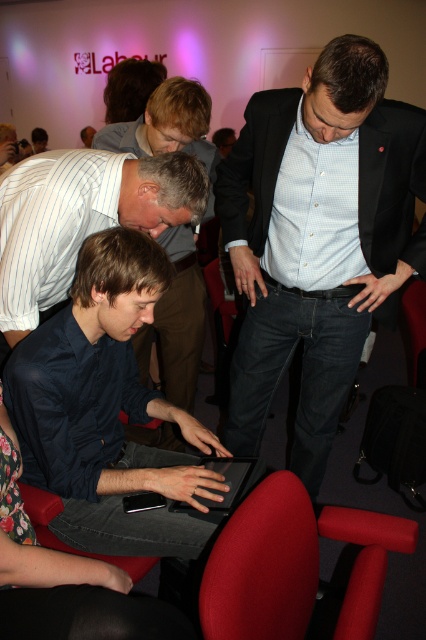
Question: Is matte black suit at center thinner than black matte tablet at center?

Choices:
 (A) yes
 (B) no

Answer: (B)

Question: From the image, what is the correct spatial relationship of velvet red chair at lower center in relation to dark blue shirt at center?

Choices:
 (A) above
 (B) below

Answer: (B)

Question: Which of the following is the farthest from the observer?

Choices:
 (A) [126, 124]
 (B) [236, 465]
 (C) [317, 474]
 (D) [304, 552]

Answer: (C)

Question: Which of the following is the closest to the observer?

Choices:
 (A) (216, 502)
 (B) (281, 618)
 (C) (178, 88)
 (D) (348, 77)

Answer: (B)

Question: Is matte black suit at center thinner than velvet red chair at lower center?

Choices:
 (A) no
 (B) yes

Answer: (A)

Question: Which point is farther to the camera?

Choices:
 (A) (408, 196)
 (B) (356, 586)
 (C) (175, 116)

Answer: (C)